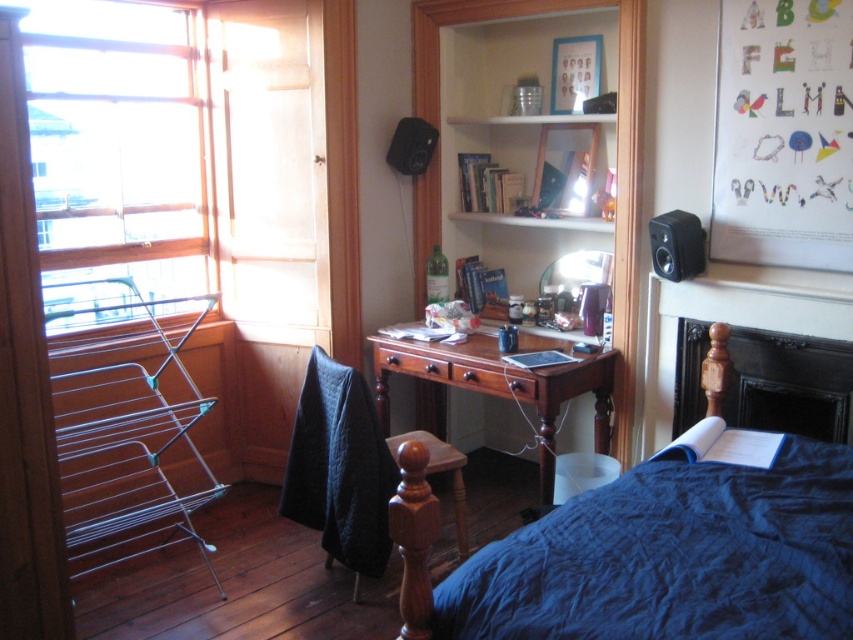
Question: Can you confirm if wooden shelf at upper center is smaller than black plastic speaker at upper right?

Choices:
 (A) yes
 (B) no

Answer: (B)

Question: Can you confirm if wooden bookshelf at upper center is smaller than black plastic speaker at upper center?

Choices:
 (A) yes
 (B) no

Answer: (B)

Question: Is the position of dark quilted fabric at lower center more distant than that of wooden shelf at upper center?

Choices:
 (A) yes
 (B) no

Answer: (B)

Question: Which of the following is the farthest from the observer?

Choices:
 (A) (572, 374)
 (B) (428, 147)

Answer: (B)

Question: Which point is closer to the camera?

Choices:
 (A) black plastic speaker at upper center
 (B) dark quilted fabric at lower center
 (C) black plastic speaker at upper right

Answer: (B)

Question: Which point is farther from the camera taking this photo?

Choices:
 (A) (410, 152)
 (B) (184, 131)

Answer: (B)